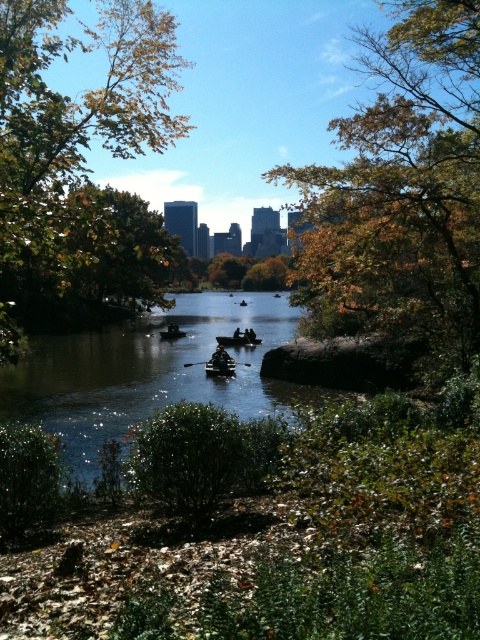
You are standing at the point marked by the coordinates point [222,358] in the image. Looking around, you see the dark blue fabric boat at center. What is the direction of the cityscape relative to your current position?

The cityscape is in the background, so it is behind you relative to your position at point [222,358].

You are standing at the edge of the water and see the dark blue fabric boat at center and the wooden canoe at center. Which boat is closer to the left side of the scene?

The dark blue fabric boat at center is closer to the left side of the scene because it is positioned to the left of the wooden canoe at center.

You are standing in the park and want to take a photo of the green leafy tree at center and the silhouette wooden boat at center. Which object should you focus on first to ensure both are in the frame?

You should focus on the green leafy tree at center first because it is closer to you than the silhouette wooden boat at center, so adjusting the camera to capture it ensures the boat will also be in the frame.